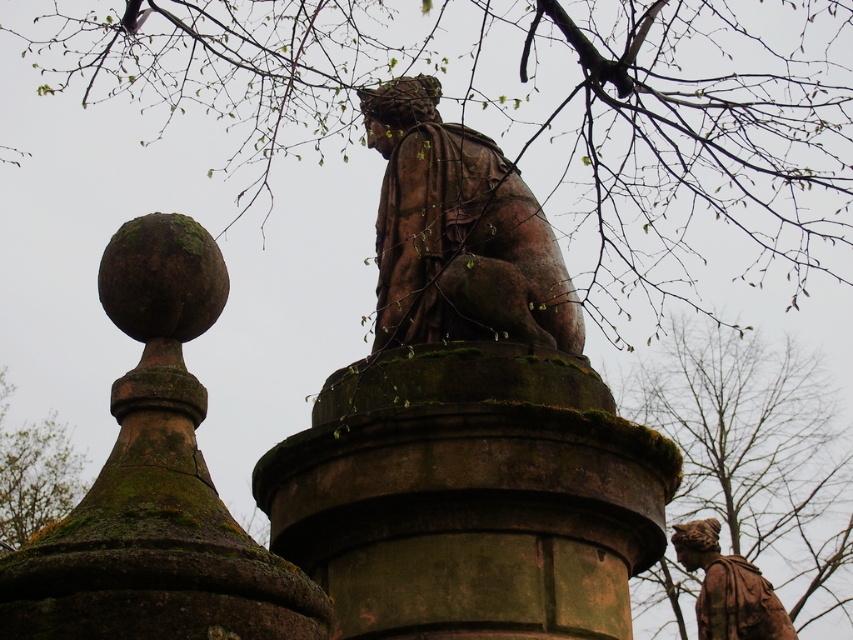
You are planning to place a new bench in the garden. The bench requires a space wider than the green mossy stone at upper left. Can the green mossy tree at lower right provide enough space for the bench?

The green mossy tree at lower right might be wider than green mossy stone at upper left, so it could potentially provide enough space for the bench.

You are standing in front of the monument and notice two elements. The first is the green mossy tree at upper center and the second is the rustic stone statue at center. From your perspective, which one is positioned to the right?

The green mossy tree at upper center is to the right of the rustic stone statue at center.

You are a botanist examining the monument and notice a point marked at coordinates (755, 452). Based on the monument description, what is located at that point?

The point at coordinates (755, 452) indicates a green mossy tree at lower right.